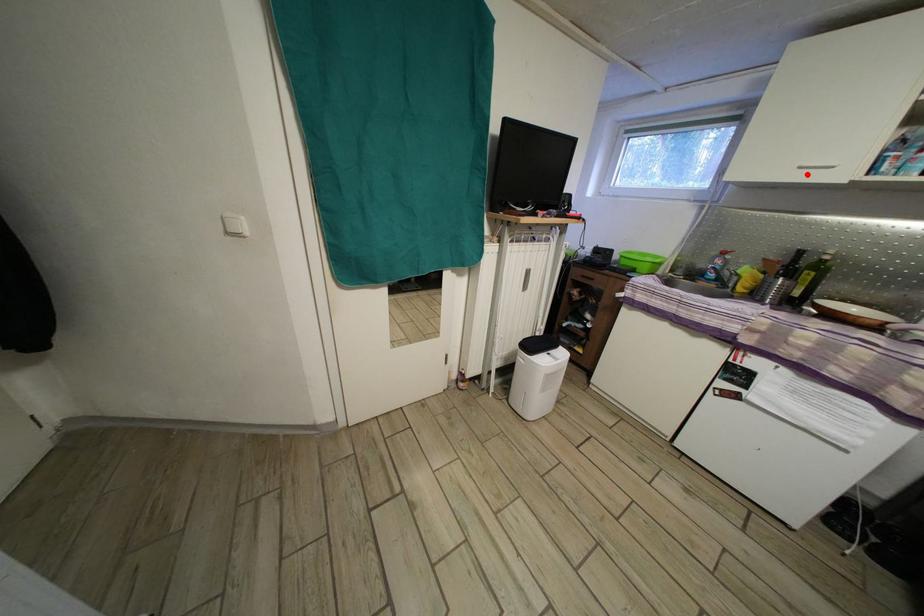
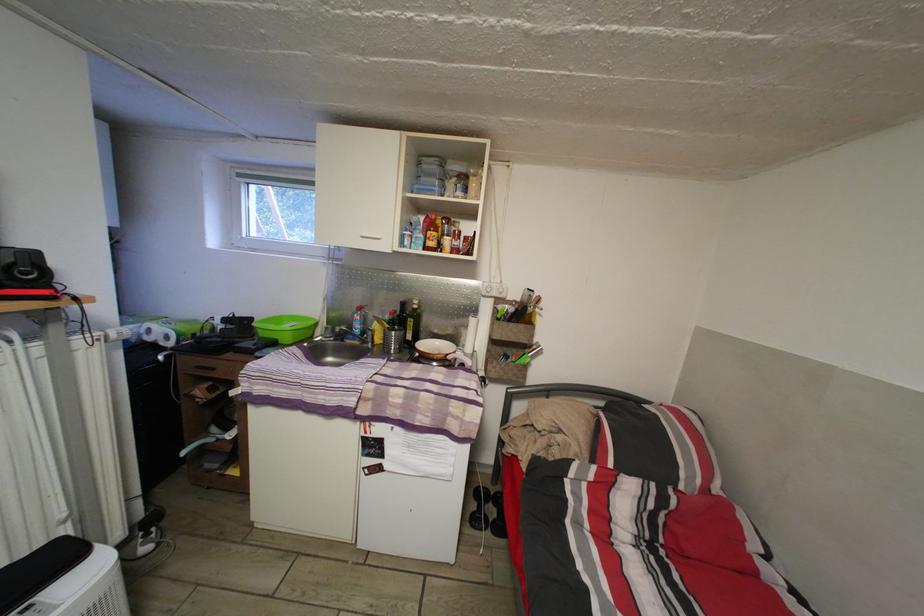
Locate, in the second image, the point that corresponds to the highlighted location in the first image.

(370, 244)